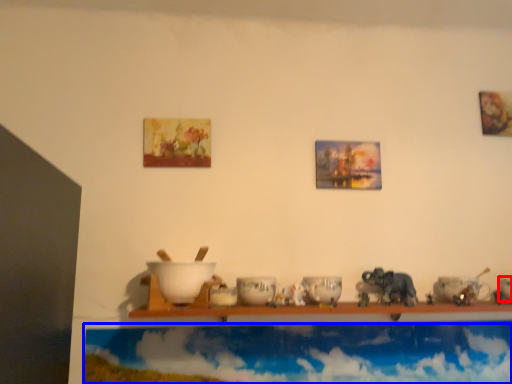
Question: Which object is closer to the camera taking this photo, tableware (highlighted by a red box) or cloud (highlighted by a blue box)?

Choices:
 (A) tableware
 (B) cloud

Answer: (A)